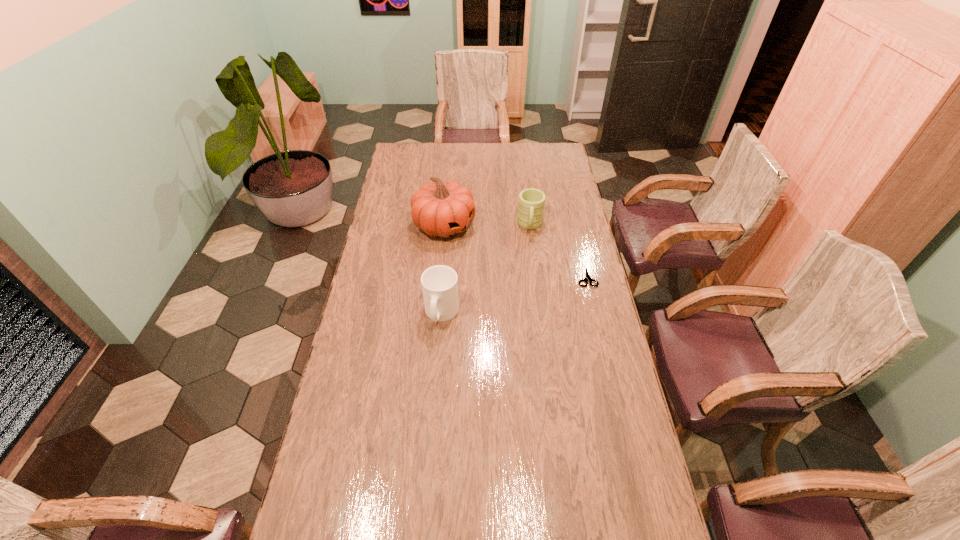
The image size is (960, 540). In the image, there is a desktop. Identify the location of vacant space at the right edge. (582, 309).

Locate an element on the screen. The image size is (960, 540). vacant space at the near left corner of the desktop is located at coordinates (346, 507).

Where is `empty space that is in between the pumpkin and the shears`? empty space that is in between the pumpkin and the shears is located at coordinates click(516, 251).

This screenshot has width=960, height=540. I want to click on free point between the pumpkin and the second object from right to left, so click(x=488, y=225).

Where is `free space between the left mug and the shortest object`? The image size is (960, 540). free space between the left mug and the shortest object is located at coordinates (515, 295).

The image size is (960, 540). Identify the location of vacant space in between the shortest object and the pumpkin. (516, 251).

Locate an element on the screen. This screenshot has width=960, height=540. empty space that is in between the second nearest object and the nearer mug is located at coordinates (515, 295).

The height and width of the screenshot is (540, 960). Find the location of `free spot between the right mug and the pumpkin`. free spot between the right mug and the pumpkin is located at coordinates (488, 225).

This screenshot has height=540, width=960. I want to click on object that can be found as the third closest to the nearest object, so click(587, 277).

Point out which object is positioned as the third nearest to the farther mug. Please provide its 2D coordinates. Your answer should be formatted as a tuple, i.e. [(x, y)], where the tuple contains the x and y coordinates of a point satisfying the conditions above.

[(439, 283)]